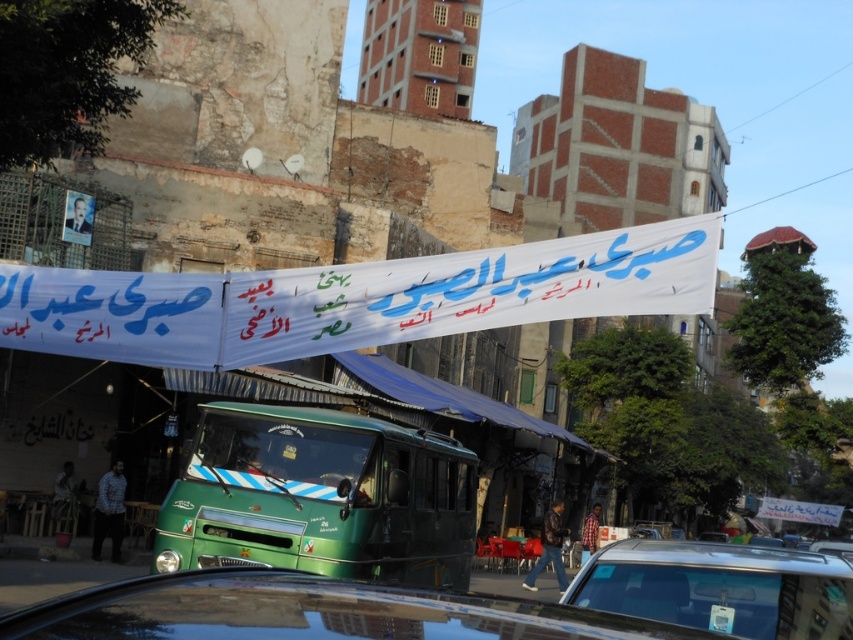
You are a delivery person trying to park your vehicle between the green matte bus at center and the shiny black car at lower right. Considering their heights, which vehicle should you position your delivery van closer to?

You should position your delivery van closer to the shiny black car at lower right because the green matte bus at center is taller than the shiny black car at lower right, so the car is shorter and might allow for easier maneuvering under low obstacles or clearance.

You are a photographer standing at the center of the street. You notice two points marked in the scene. The first point is at coordinate point (297,460) and the second is at point (573,580). Which point is closer to your camera?

Point (297,460) is closer to the camera than point (573,580) because it is further to the camera than the other point.